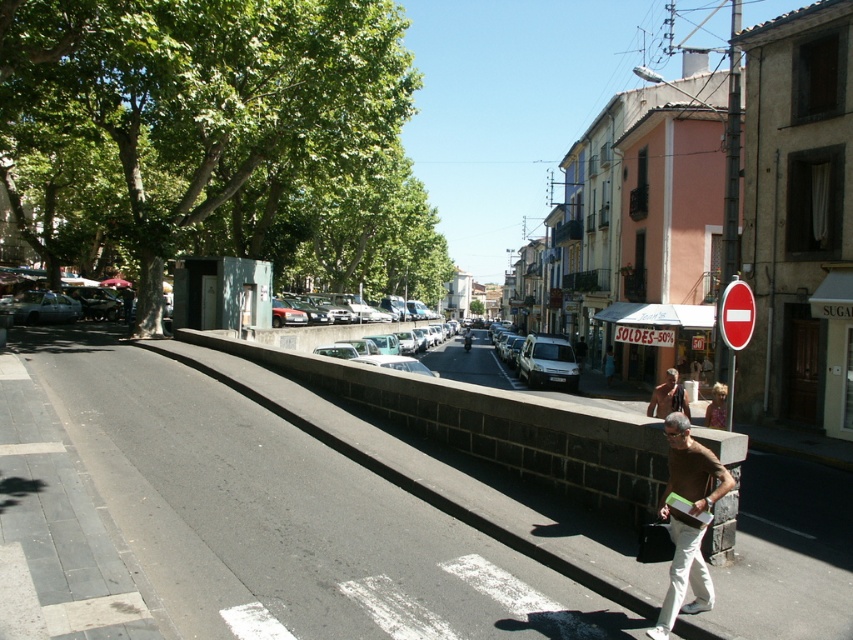
Question: Is red plastic sign at center right below brown leather jacket at center?

Choices:
 (A) yes
 (B) no

Answer: (B)

Question: Can you confirm if brown cotton shirt at lower right is wider than brown leather jacket at center?

Choices:
 (A) no
 (B) yes

Answer: (A)

Question: Which object is closer to the camera taking this photo?

Choices:
 (A) brown leather jacket at center
 (B) red plastic sign at center right
 (C) brown cotton shirt at lower right

Answer: (C)

Question: Is red plastic sign at center right positioned before brown leather jacket at center?

Choices:
 (A) yes
 (B) no

Answer: (A)

Question: Which point is farther to the camera?

Choices:
 (A) (669, 376)
 (B) (677, 428)

Answer: (A)

Question: Considering the real-world distances, which object is farthest from the red plastic sign at center right?

Choices:
 (A) brown cotton shirt at lower right
 (B) brown leather jacket at center

Answer: (B)